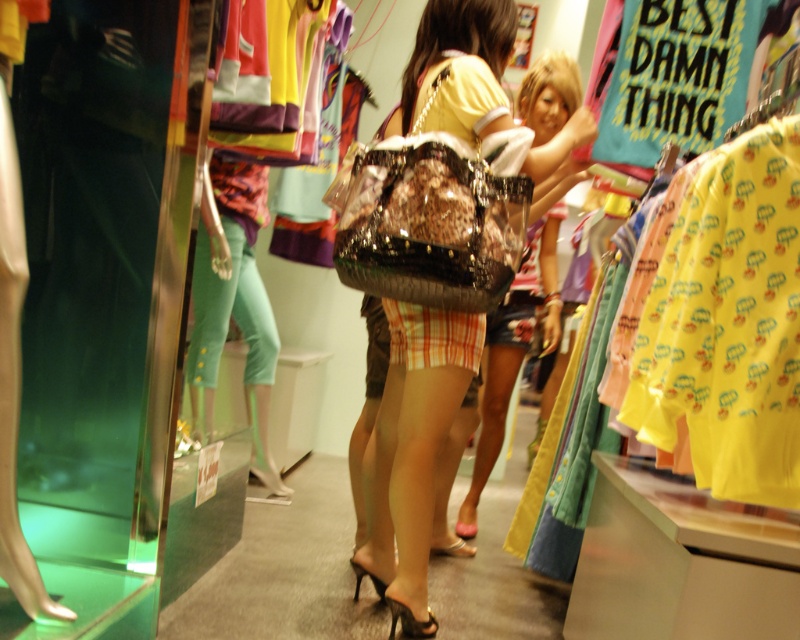
Between point (404, 500) and point (458, 420), which one is positioned in front?

Point (404, 500) is more forward.

Which is below, translucent plastic bag at center or plaid fabric skirt at center?

translucent plastic bag at center is lower down.

Is point (408, 477) more distant than point (542, 285)?

No, (408, 477) is in front of (542, 285).

The width and height of the screenshot is (800, 640). In order to click on translucent plastic bag at center in this screenshot , I will do `click(414, 444)`.

Does translucent plastic bag at center have a lesser width compared to black patent leather high-heeled sandal at lower center?

No, translucent plastic bag at center is not thinner than black patent leather high-heeled sandal at lower center.

Does point (462, 67) lie in front of point (405, 634)?

Yes.

This screenshot has height=640, width=800. I want to click on translucent plastic bag at center, so click(x=414, y=444).

Where is `translucent plastic bag at center`? This screenshot has width=800, height=640. translucent plastic bag at center is located at coordinates (414, 444).

Can you confirm if plaid fabric skirt at center is positioned above shiny pink sandal at lower center?

Correct, plaid fabric skirt at center is located above shiny pink sandal at lower center.

Which is in front, point (542, 193) or point (468, 531)?

Positioned in front is point (542, 193).

Where is `plaid fabric skirt at center`? The image size is (800, 640). plaid fabric skirt at center is located at coordinates click(513, 317).